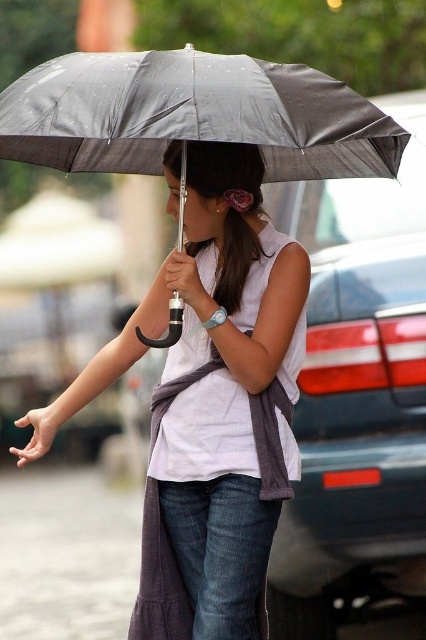
Question: Does matte gray umbrella at upper center have a smaller size compared to metallic gray umbrella at center?

Choices:
 (A) yes
 (B) no

Answer: (A)

Question: Can you confirm if matte gray umbrella at upper center is positioned below metallic gray umbrella at center?

Choices:
 (A) yes
 (B) no

Answer: (A)

Question: Among these objects, which one is nearest to the camera?

Choices:
 (A) matte gray umbrella at upper center
 (B) metallic gray umbrella at center

Answer: (B)

Question: Is matte gray umbrella at upper center thinner than metallic gray umbrella at center?

Choices:
 (A) no
 (B) yes

Answer: (B)